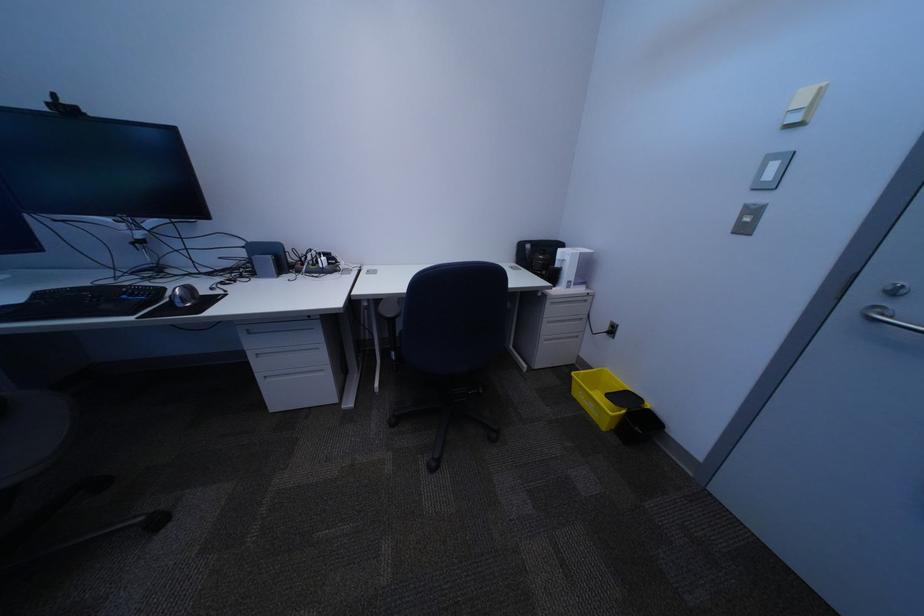
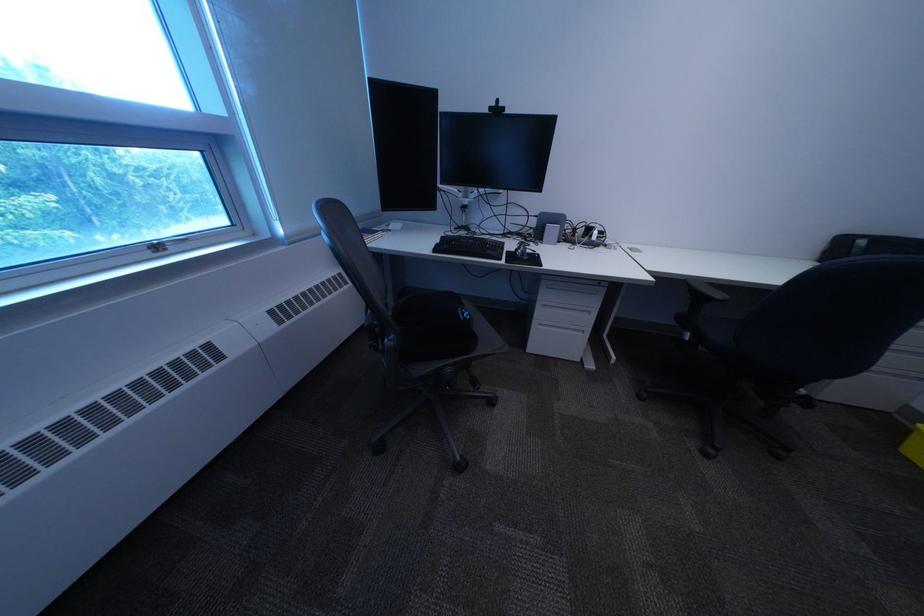
The point at (61,111) is marked in the first image. Where is the corresponding point in the second image?

(503, 113)